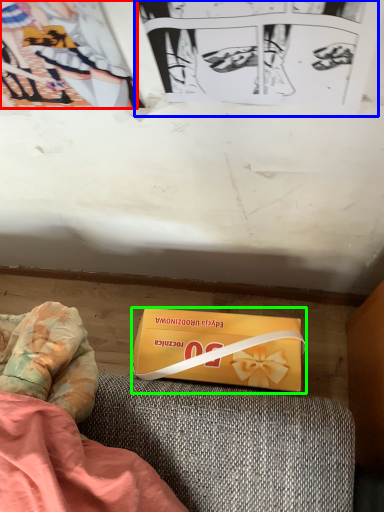
Question: Based on their relative distances, which object is nearer to couple (highlighted by a red box)? Choose from paperback book (highlighted by a blue box) and box (highlighted by a green box).

Choices:
 (A) paperback book
 (B) box

Answer: (A)